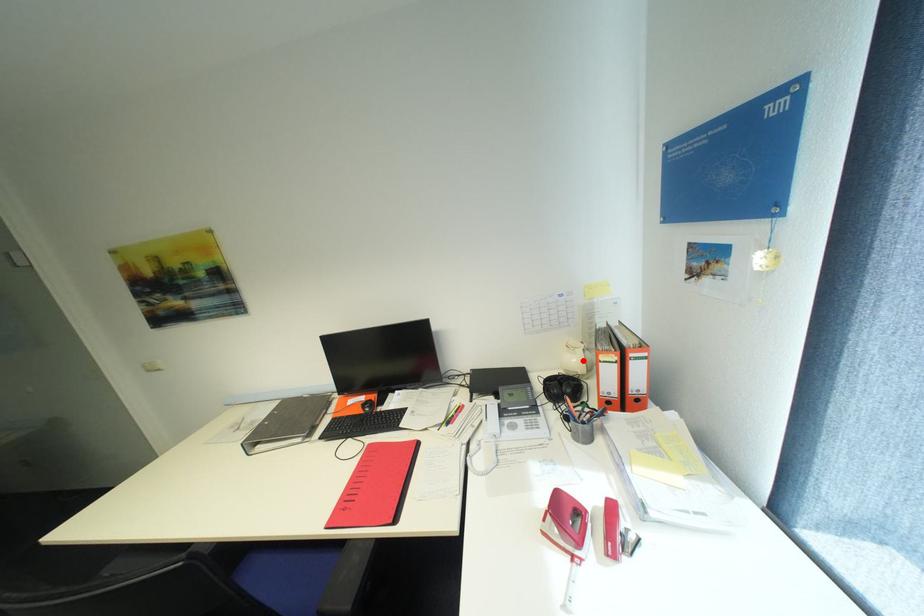
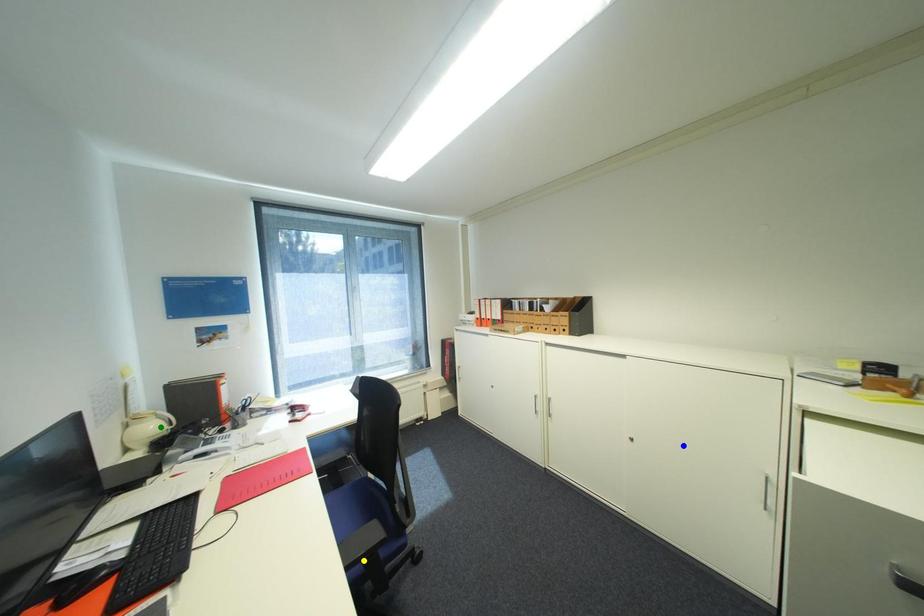
Question: I am providing you with two images of the same scene from different viewpoints. A red point is marked on the first image. You are given multiple points on the second image. Which spot in image 2 lines up with the point in image 1?

Choices:
 (A) yellow point
 (B) blue point
 (C) green point

Answer: (C)